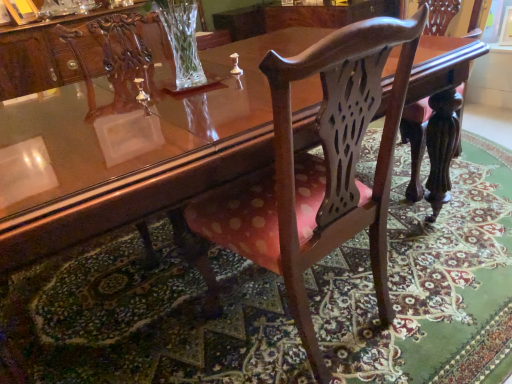
Question: From the image's perspective, is pink fabric chair at center under polka dot fabric chair at center?

Choices:
 (A) no
 (B) yes

Answer: (B)

Question: Is pink fabric chair at center outside of polka dot fabric chair at center?

Choices:
 (A) yes
 (B) no

Answer: (A)

Question: Considering the relative sizes of pink fabric chair at center and polka dot fabric chair at center in the image provided, is pink fabric chair at center wider than polka dot fabric chair at center?

Choices:
 (A) yes
 (B) no

Answer: (A)

Question: From a real-world perspective, is pink fabric chair at center over polka dot fabric chair at center?

Choices:
 (A) no
 (B) yes

Answer: (A)

Question: Does pink fabric chair at center appear on the right side of polka dot fabric chair at center?

Choices:
 (A) no
 (B) yes

Answer: (B)

Question: From a real-world perspective, is pink fabric chair at center physically below polka dot fabric chair at center?

Choices:
 (A) yes
 (B) no

Answer: (A)

Question: Could you tell me if polka dot fabric chair at center is turned towards pink fabric chair at center?

Choices:
 (A) no
 (B) yes

Answer: (A)

Question: Is polka dot fabric chair at center further to camera compared to pink fabric chair at center?

Choices:
 (A) no
 (B) yes

Answer: (A)

Question: Is polka dot fabric chair at center to the right of pink fabric chair at center from the viewer's perspective?

Choices:
 (A) yes
 (B) no

Answer: (B)

Question: Is polka dot fabric chair at center completely or partially outside of pink fabric chair at center?

Choices:
 (A) no
 (B) yes

Answer: (B)

Question: From a real-world perspective, does polka dot fabric chair at center stand above pink fabric chair at center?

Choices:
 (A) no
 (B) yes

Answer: (B)

Question: Is polka dot fabric chair at center beside pink fabric chair at center?

Choices:
 (A) no
 (B) yes

Answer: (A)

Question: Is pink fabric chair at center taller or shorter than polka dot fabric chair at center?

Choices:
 (A) tall
 (B) short

Answer: (B)